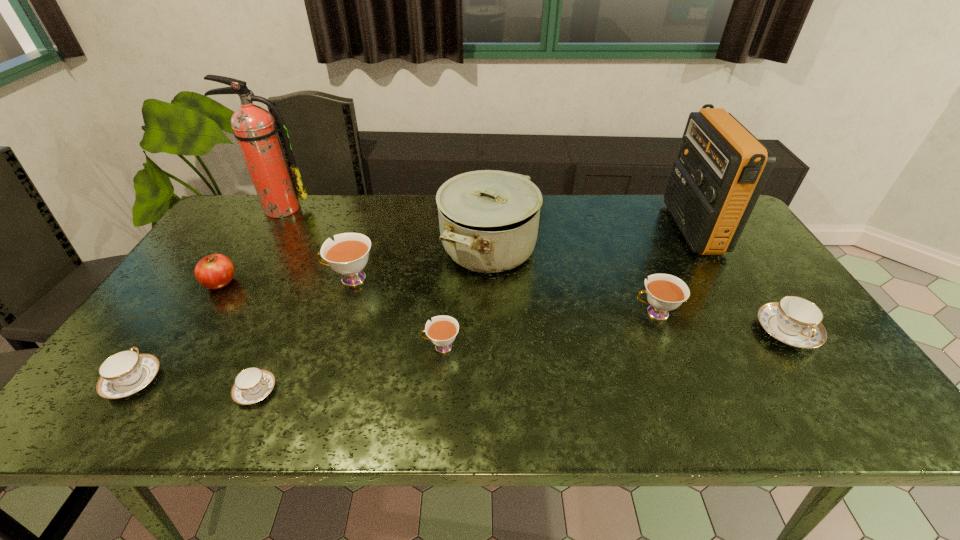
You are a GUI agent. You are given a task and a screenshot of the screen. Output one action in this format:
    pyautogui.click(x=<x>, y=<y>)
    Task: Click on the vacant space located 0.120m on the side of the smallest white teacup with the handle
    This screenshot has width=960, height=540.
    Given the screenshot: What is the action you would take?
    pyautogui.click(x=372, y=347)

Find the location of `vacant position located on the side of the smallest white teacup with the handle`. vacant position located on the side of the smallest white teacup with the handle is located at coordinates (314, 347).

The width and height of the screenshot is (960, 540). Find the location of `blank area located on the side with the handle of the leftmost blue teacup`. blank area located on the side with the handle of the leftmost blue teacup is located at coordinates (184, 307).

You are a GUI agent. You are given a task and a screenshot of the screen. Output one action in this format:
    pyautogui.click(x=<x>, y=<y>)
    Task: Click on the vacant position located 0.270m on the side with the handle of the leftmost blue teacup
    This screenshot has height=540, width=960.
    Given the screenshot: What is the action you would take?
    pyautogui.click(x=203, y=281)

Image resolution: width=960 pixels, height=540 pixels. I want to click on vacant space located on the side with the handle of the leftmost blue teacup, so click(196, 291).

Identify the location of vacant region located on the side with the handle of the fourth object from left to right. Image resolution: width=960 pixels, height=540 pixels. (432, 390).

Identify the location of fire extinguisher that is at the far edge. (254, 128).

The height and width of the screenshot is (540, 960). Identify the location of radio receiver at the far edge. (721, 170).

Identify the location of saucepan positioned at the far edge. The image size is (960, 540). (488, 219).

Find the location of a particular element. Image resolution: width=960 pixels, height=540 pixels. fire extinguisher present at the left edge is located at coordinates click(254, 128).